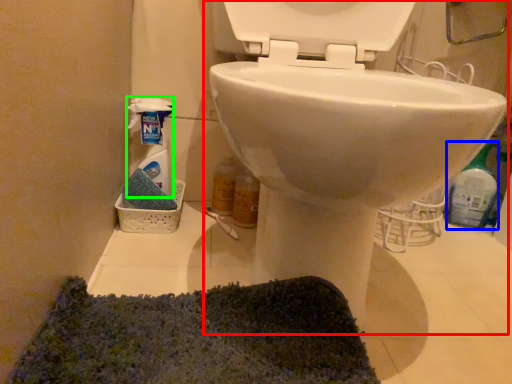
Question: Which is nearer to the toilet (highlighted by a red box)? cleaning product (highlighted by a blue box) or cleaning product (highlighted by a green box).

Choices:
 (A) cleaning product
 (B) cleaning product

Answer: (B)